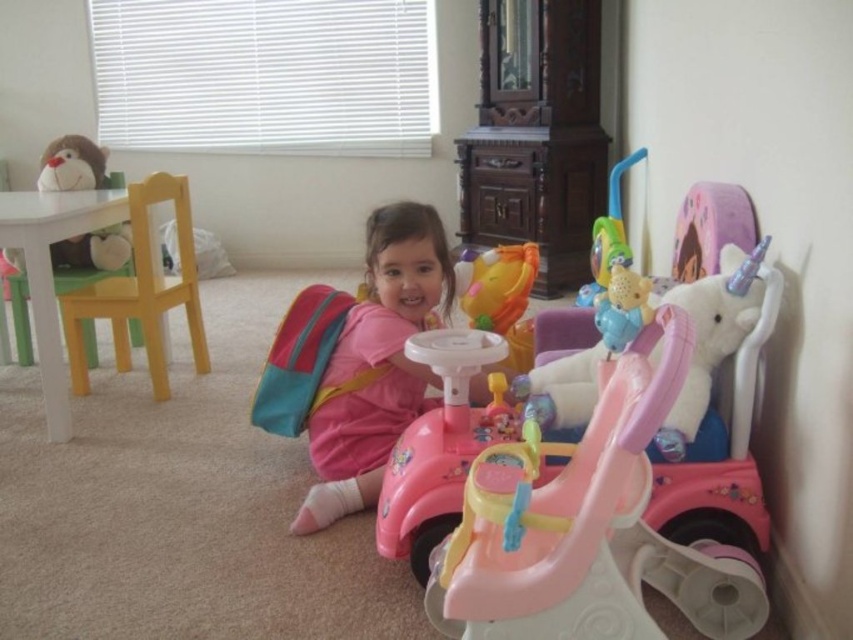
Who is higher up, pink matte backpack at center or yellow matte chair at left?

yellow matte chair at left is above.

Is pink matte backpack at center below yellow matte chair at left?

Yes, pink matte backpack at center is below yellow matte chair at left.

You are a GUI agent. You are given a task and a screenshot of the screen. Output one action in this format:
    pyautogui.click(x=<x>, y=<y>)
    Task: Click on the pink matte backpack at center
    
    Given the screenshot: What is the action you would take?
    pyautogui.click(x=376, y=362)

Is pink matte backpack at center behind fluffy plush monkey at upper left?

No, pink matte backpack at center is closer to the viewer.

Does pink matte backpack at center have a lesser height compared to fluffy plush monkey at upper left?

Incorrect, pink matte backpack at center's height does not fall short of fluffy plush monkey at upper left's.

Which is behind, point (399, 248) or point (53, 144)?

Point (53, 144)

Image resolution: width=853 pixels, height=640 pixels. Find the location of `pink matte backpack at center`. pink matte backpack at center is located at coordinates (376, 362).

Who is more distant from viewer, (164, 380) or (109, 269)?

Positioned behind is point (109, 269).

Image resolution: width=853 pixels, height=640 pixels. What do you see at coordinates (141, 291) in the screenshot?
I see `yellow matte chair at left` at bounding box center [141, 291].

Where is `yellow matte chair at left`? The image size is (853, 640). yellow matte chair at left is located at coordinates (141, 291).